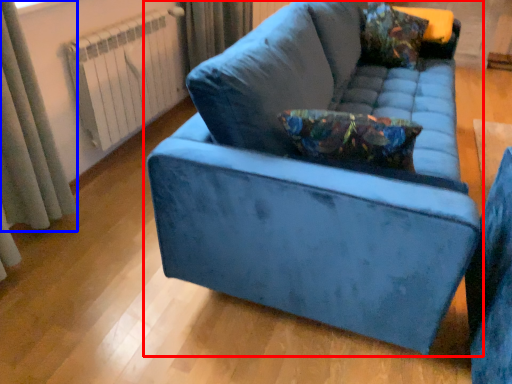
Question: Among these objects, which one is farthest to the camera, studio couch (highlighted by a red box) or curtain (highlighted by a blue box)?

Choices:
 (A) studio couch
 (B) curtain

Answer: (B)